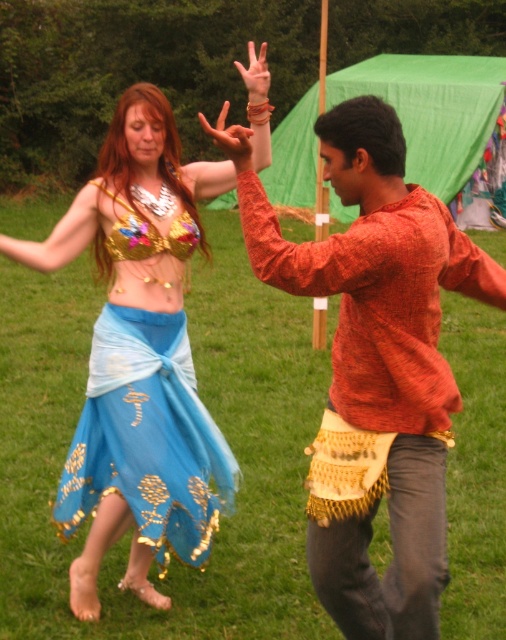
Question: Is matte gold bra at center wider than blue sheer skirt at left?

Choices:
 (A) no
 (B) yes

Answer: (B)

Question: Considering the relative positions of orange woven shirt at center and blue sheer skirt at left in the image provided, where is orange woven shirt at center located with respect to blue sheer skirt at left?

Choices:
 (A) below
 (B) above

Answer: (B)

Question: Based on their relative distances, which object is nearer to the blue sheer skirt at left?

Choices:
 (A) matte gold bra at center
 (B) green grass at center

Answer: (A)

Question: Does orange woven shirt at center have a lesser width compared to blue sheer skirt at left?

Choices:
 (A) yes
 (B) no

Answer: (B)

Question: Estimate the real-world distances between objects in this image. Which object is farther from the orange woven shirt at center?

Choices:
 (A) green grass at center
 (B) blue sheer skirt at left

Answer: (A)

Question: Which of the following is the closest to the observer?

Choices:
 (A) (173, 250)
 (B) (161, 310)

Answer: (B)